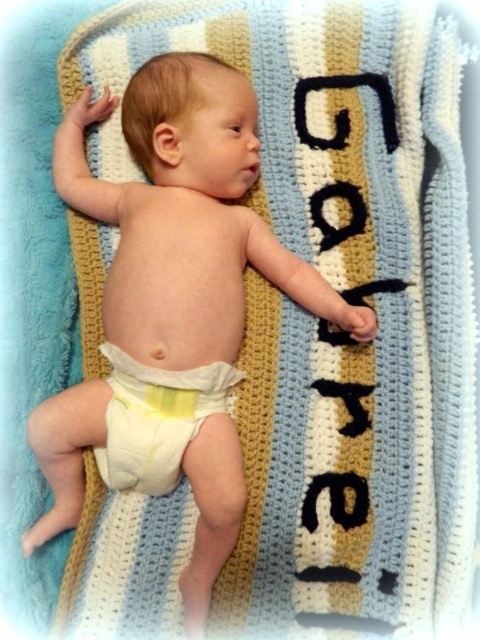
Question: Is smooth white diaper at center below yellow fabric diaper at center?

Choices:
 (A) yes
 (B) no

Answer: (B)

Question: Which point is closer to the camera?

Choices:
 (A) (152, 330)
 (B) (127, 484)

Answer: (A)

Question: Is smooth white diaper at center behind yellow fabric diaper at center?

Choices:
 (A) yes
 (B) no

Answer: (B)

Question: Does smooth white diaper at center come in front of yellow fabric diaper at center?

Choices:
 (A) no
 (B) yes

Answer: (B)